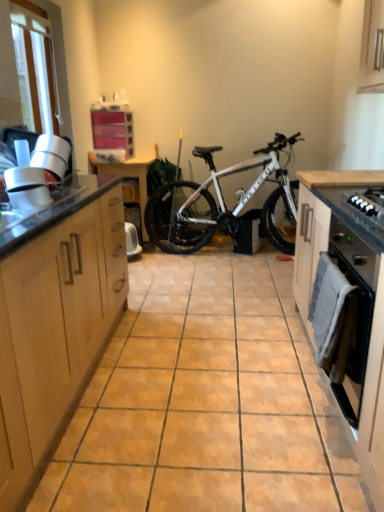
Question: Is light wood cabinet at left, the 1th cabinetry positioned from the left, not inside black matte oven door at right, which ranks as the second cabinetry in left-to-right order?

Choices:
 (A) no
 (B) yes

Answer: (B)

Question: Is light wood cabinet at left, the 1th cabinetry positioned from the left, at the left side of black matte oven door at right, which ranks as the second cabinetry in left-to-right order?

Choices:
 (A) yes
 (B) no

Answer: (A)

Question: From a real-world perspective, is light wood cabinet at left, positioned as the second cabinetry in right-to-left order, on black matte oven door at right, marked as the 1th cabinetry in a right-to-left arrangement?

Choices:
 (A) yes
 (B) no

Answer: (A)

Question: Can you confirm if light wood cabinet at left, the 1th cabinetry positioned from the left, is shorter than black matte oven door at right, marked as the 1th cabinetry in a right-to-left arrangement?

Choices:
 (A) yes
 (B) no

Answer: (B)

Question: Is light wood cabinet at left, the 1th cabinetry positioned from the left, further to camera compared to black matte oven door at right, marked as the 1th cabinetry in a right-to-left arrangement?

Choices:
 (A) no
 (B) yes

Answer: (A)

Question: Considering the relative sizes of light wood cabinet at left, positioned as the second cabinetry in right-to-left order, and black matte oven door at right, marked as the 1th cabinetry in a right-to-left arrangement, in the image provided, is light wood cabinet at left, positioned as the second cabinetry in right-to-left order, bigger than black matte oven door at right, marked as the 1th cabinetry in a right-to-left arrangement,?

Choices:
 (A) yes
 (B) no

Answer: (A)

Question: Considering the relative sizes of black matte oven at right and black matte gas stove at right in the image provided, is black matte oven at right wider than black matte gas stove at right?

Choices:
 (A) no
 (B) yes

Answer: (A)

Question: Does black matte oven at right have a smaller size compared to black matte gas stove at right?

Choices:
 (A) yes
 (B) no

Answer: (B)

Question: Considering the relative sizes of black matte oven at right and black matte gas stove at right in the image provided, is black matte oven at right thinner than black matte gas stove at right?

Choices:
 (A) yes
 (B) no

Answer: (A)

Question: Would you consider black matte oven at right to be distant from black matte gas stove at right?

Choices:
 (A) yes
 (B) no

Answer: (B)

Question: Is black matte oven at right further to the viewer compared to black matte gas stove at right?

Choices:
 (A) yes
 (B) no

Answer: (A)

Question: Considering the relative positions of black matte oven at right and black matte gas stove at right in the image provided, is black matte oven at right to the left of black matte gas stove at right from the viewer's perspective?

Choices:
 (A) yes
 (B) no

Answer: (A)

Question: Is black matte oven door at right, marked as the 1th cabinetry in a right-to-left arrangement, thinner than black matte oven at right?

Choices:
 (A) no
 (B) yes

Answer: (A)